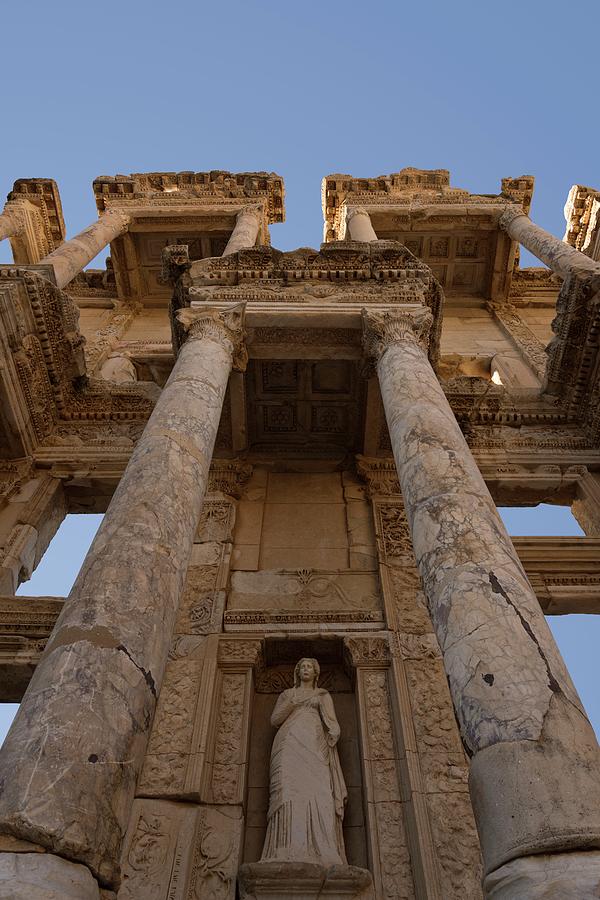
You are a GUI agent. You are given a task and a screenshot of the screen. Output one action in this format:
    pyautogui.click(x=<x>, y=<y>)
    Task: Click on the ceiling tile
    This screenshot has width=600, height=900.
    Given the screenshot: What is the action you would take?
    pyautogui.click(x=270, y=416), pyautogui.click(x=289, y=374), pyautogui.click(x=337, y=380), pyautogui.click(x=438, y=250), pyautogui.click(x=152, y=245)